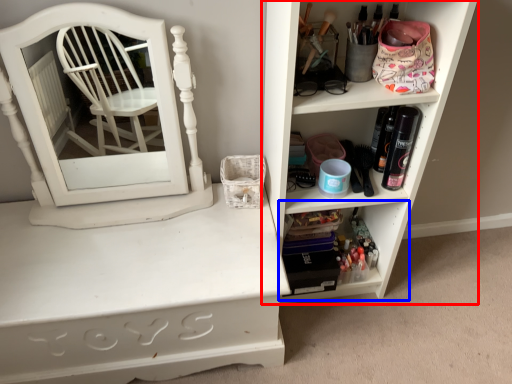
Question: Which object is closer to the camera taking this photo, shelf (highlighted by a red box) or shelf (highlighted by a blue box)?

Choices:
 (A) shelf
 (B) shelf

Answer: (A)